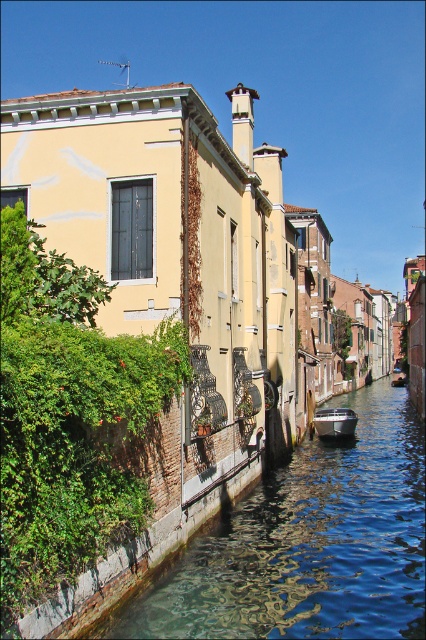
Question: Is smooth concrete canal at center bigger than metallic gray boat at lower center?

Choices:
 (A) no
 (B) yes

Answer: (B)

Question: From the image, what is the correct spatial relationship of smooth concrete canal at center in relation to metallic gray boat at lower center?

Choices:
 (A) left
 (B) right

Answer: (A)

Question: Can you confirm if smooth concrete canal at center is positioned to the right of metallic gray boat at lower center?

Choices:
 (A) yes
 (B) no

Answer: (B)